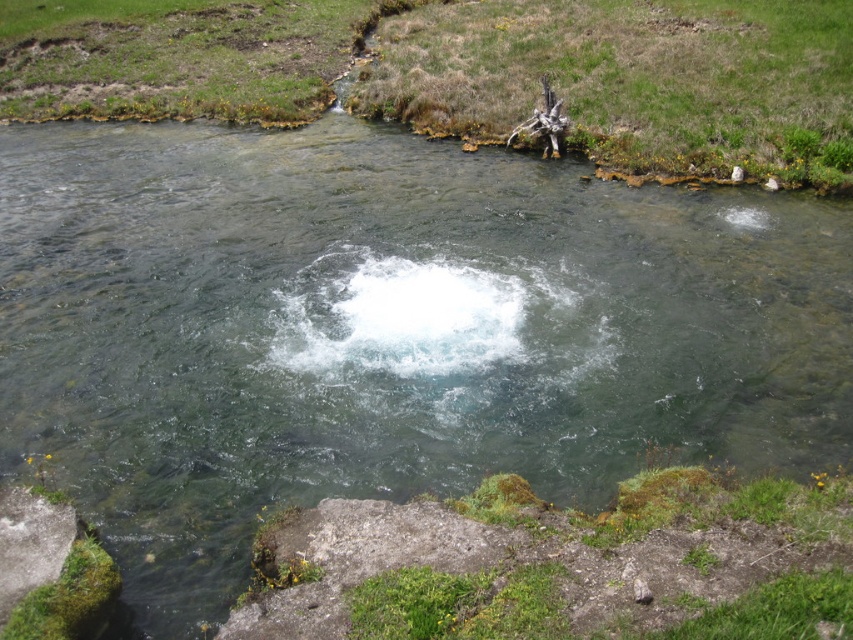
In the scene shown: You are planning to cross the stream using the gray rough rock at lower left and the brown wood log at upper right as stepping stones. Which object should you step on first based on their positions?

You should step on the gray rough rock at lower left first because it is positioned closer to the starting point at the lower bank compared to the brown wood log at upper right.

You are planning to cross the stream at the location shown in the image. You have two options to step on while crossing. One is the gray rough rock at lower left, and the other is the brown wood log at upper right. Which stepping stone is positioned lower in the stream and might be submerged under water?

The gray rough rock at lower left is located below the brown wood log at upper right, so it is positioned lower in the stream and might be submerged under water.

You are planning to cross the stream using the gray rough rock at lower left and the brown wood log at upper right as stepping stones. Which one is narrower and thus safer to step on?

The gray rough rock at lower left is narrower than the brown wood log at upper right, so it is safer to step on the gray rough rock at lower left first.